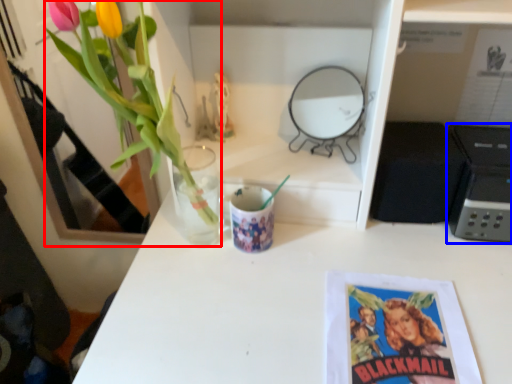
Question: Among these objects, which one is farthest to the camera, floral arrangement (highlighted by a red box) or appliance (highlighted by a blue box)?

Choices:
 (A) floral arrangement
 (B) appliance

Answer: (B)